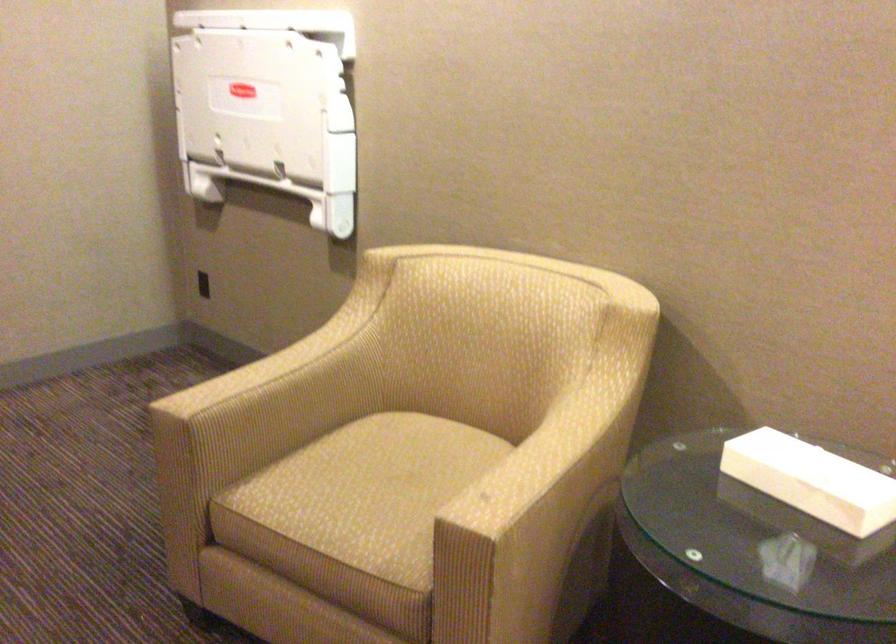
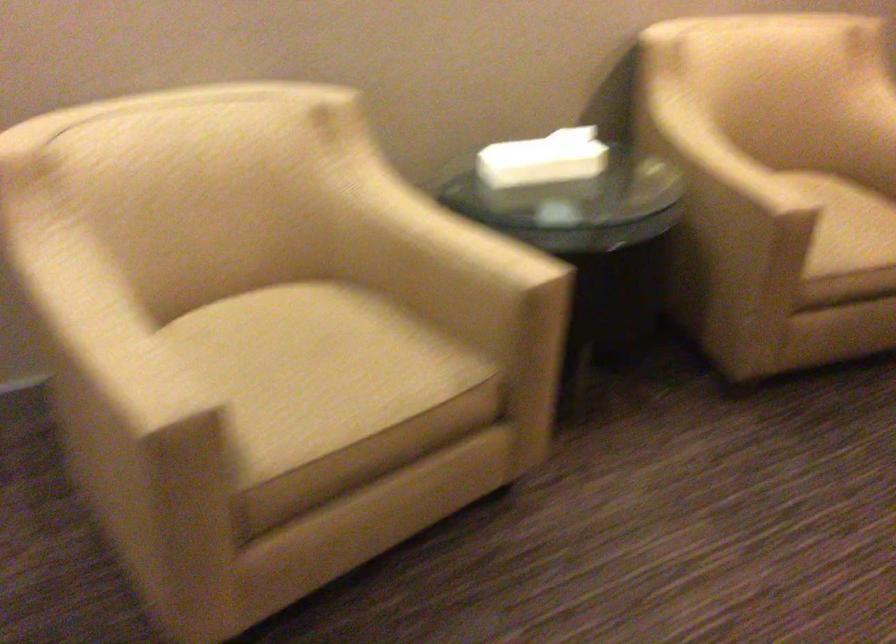
Where in the second image is the point corresponding to [785,465] from the first image?

(543, 158)